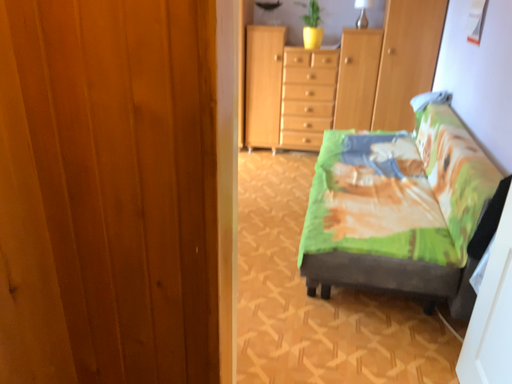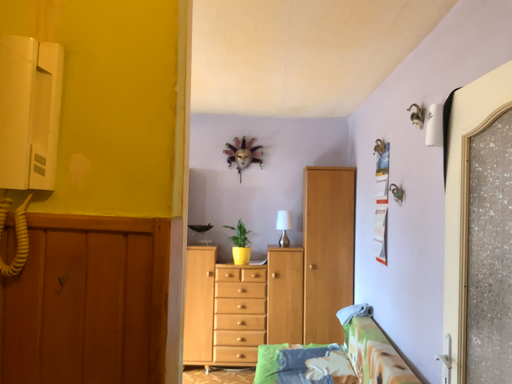
Question: Which way did the camera rotate in the video?

Choices:
 (A) rotated upward
 (B) rotated downward

Answer: (A)